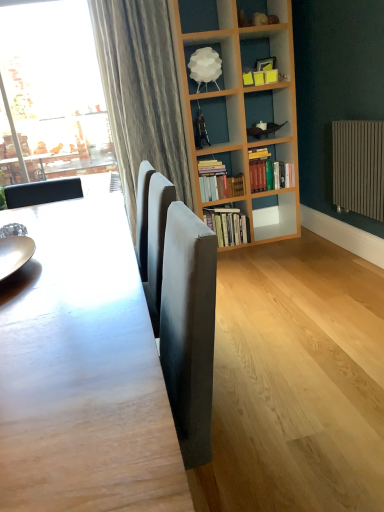
The width and height of the screenshot is (384, 512). In order to click on vacant space to the right of hardcover books at center, the 3th book when ordered from top to bottom in this screenshot , I will do `click(263, 243)`.